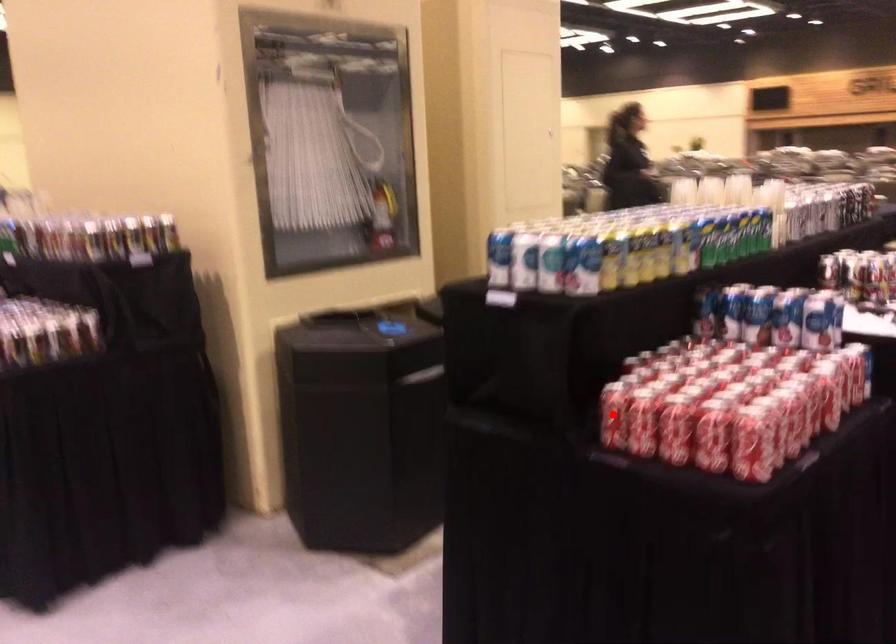
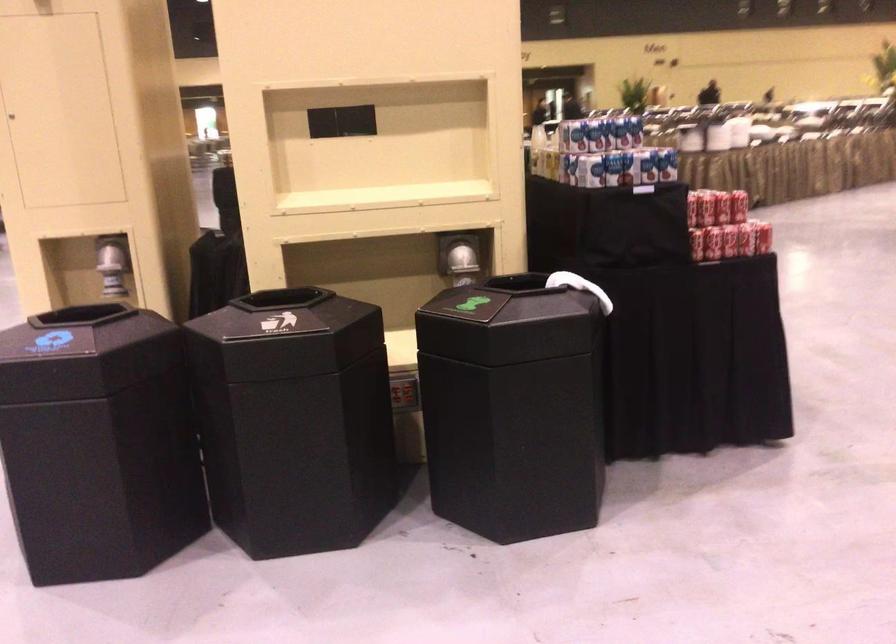
Question: I am providing you with two images of the same scene from different viewpoints. A red point is marked on the first image. Is the red point's position out of view in image 2?

Choices:
 (A) Yes
 (B) No

Answer: (A)